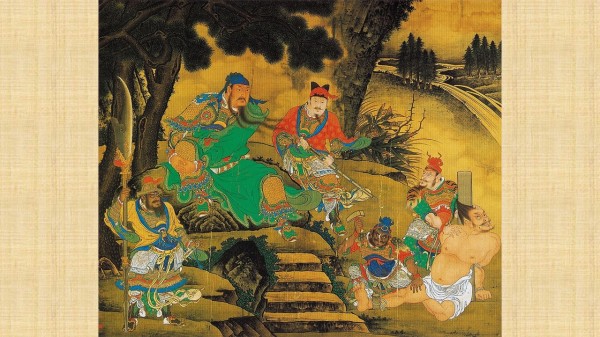
You are a GUI agent. You are given a task and a screenshot of the screen. Output one action in this format:
    pyautogui.click(x=<x>, y=<y>)
    Task: Click on the art work
    This screenshot has width=600, height=337.
    Given the screenshot: What is the action you would take?
    pyautogui.click(x=322, y=202)